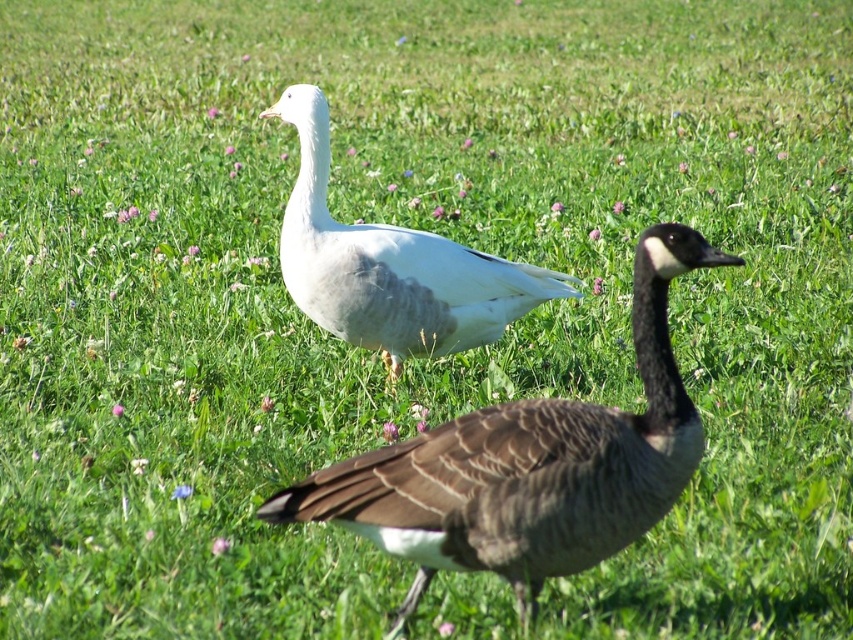
You are a birdwatcher observing two geese on a grassy field. You see the white feathered goose at upper center and the white matte goose at center. Which goose is positioned lower in the image?

The white feathered goose at upper center is positioned lower than the white matte goose at center according to their descriptions.

You are standing in the field and want to approach the white feathered goose at upper center. If you can walk 3 feet per second, how many seconds will it take you to reach the goose?

The white feathered goose at upper center is 6.82 feet away from you. At a walking speed of 3 feet per second, it would take approximately 2.27 seconds to reach the goose.

From the picture: You are standing in the field and see two points marked in the image. Which point is nearer to you, point [657,424] or point [369,323]?

Point [657,424] is closer to the viewer than point [369,323].